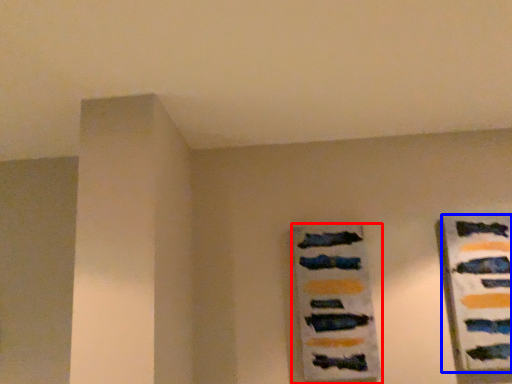
Question: Which point is closer to the camera, picture frame (highlighted by a red box) or design (highlighted by a blue box)?

Choices:
 (A) picture frame
 (B) design

Answer: (B)